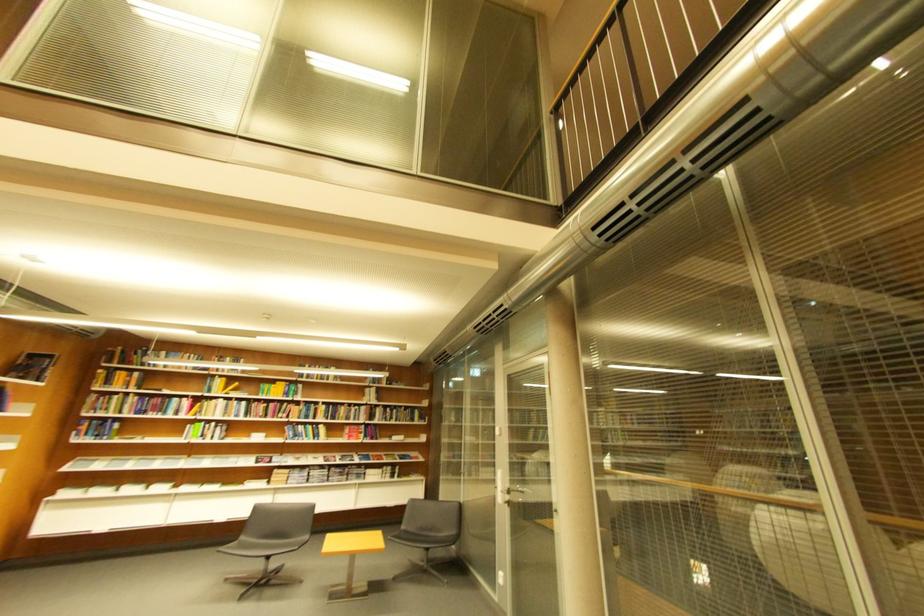
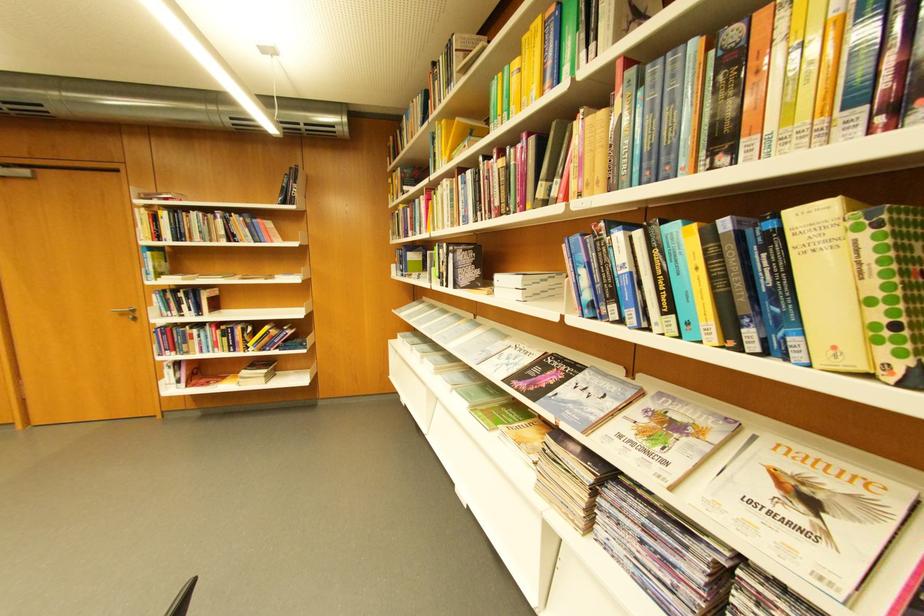
The point at (213, 438) is marked in the first image. Where is the corresponding point in the second image?

(451, 278)